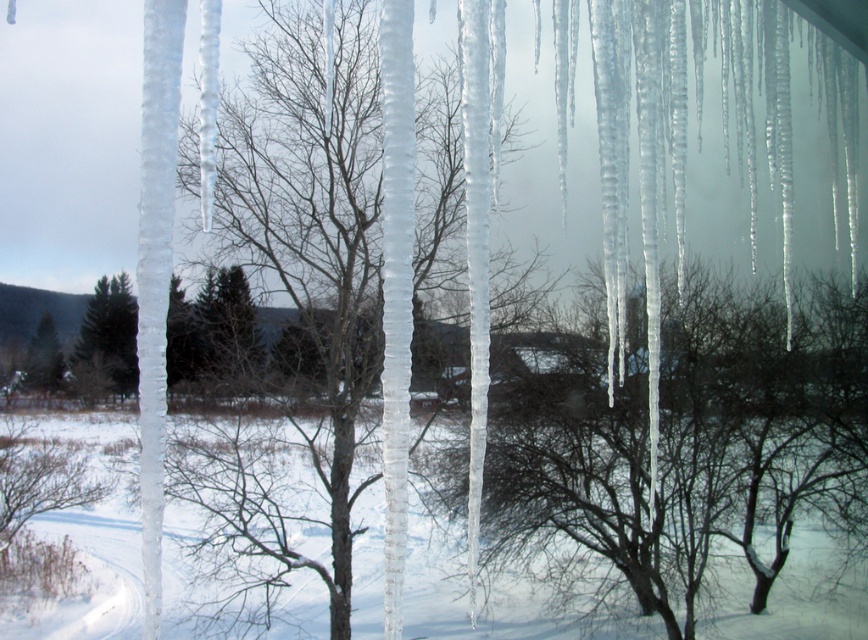
Which is in front, point (500, 419) or point (38, 371)?

Point (38, 371) is more forward.

Does point (822, 492) come farther from viewer compared to point (45, 381)?

Yes, it is behind point (45, 381).

In the scene shown: Measure the distance between translucent ice at center and camera.

A distance of 41.26 feet exists between translucent ice at center and camera.

The width and height of the screenshot is (868, 640). I want to click on translucent ice at center, so click(686, 448).

Who is lower down, green matte evergreen tree at center or green matte tree at left?

green matte tree at left

Is green matte evergreen tree at center further to camera compared to green matte tree at left?

No, it is not.

Between point (229, 278) and point (108, 374), which one is positioned in front?

Positioned in front is point (229, 278).

At what (x,y) coordinates should I click in order to perform the action: click on green matte evergreen tree at center. Please return your answer as a coordinate pair (x, y). The image size is (868, 640). Looking at the image, I should click on (228, 332).

Is green matte evergreen tree at center below green matte tree at center?

No.

Can you confirm if green matte evergreen tree at center is thinner than green matte tree at center?

Indeed, green matte evergreen tree at center has a lesser width compared to green matte tree at center.

Describe the element at coordinates (228, 332) in the screenshot. I see `green matte evergreen tree at center` at that location.

The height and width of the screenshot is (640, 868). What are the coordinates of `green matte evergreen tree at center` in the screenshot? It's located at (228, 332).